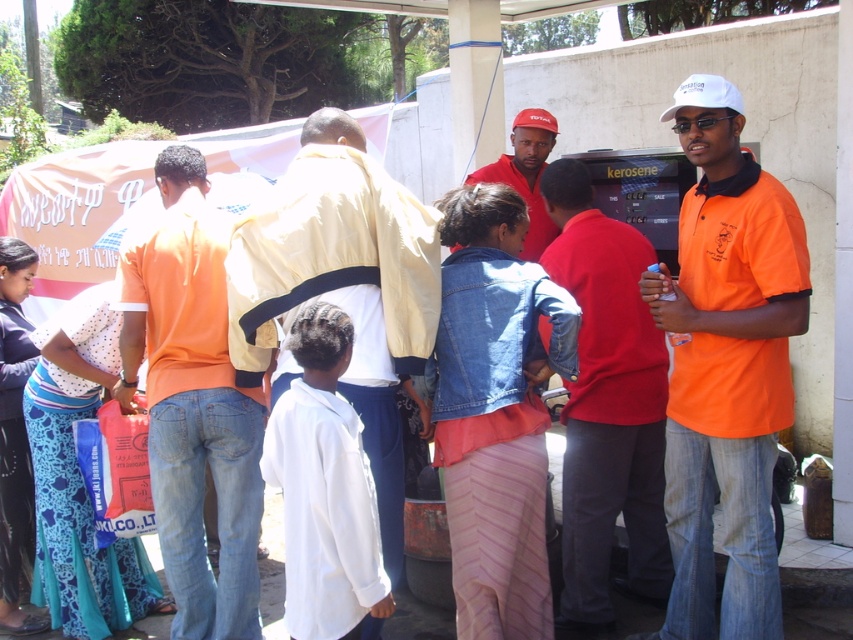
What are the coordinates of the orange cotton shirt at center?

The orange cotton shirt at center is located at point (193,401).